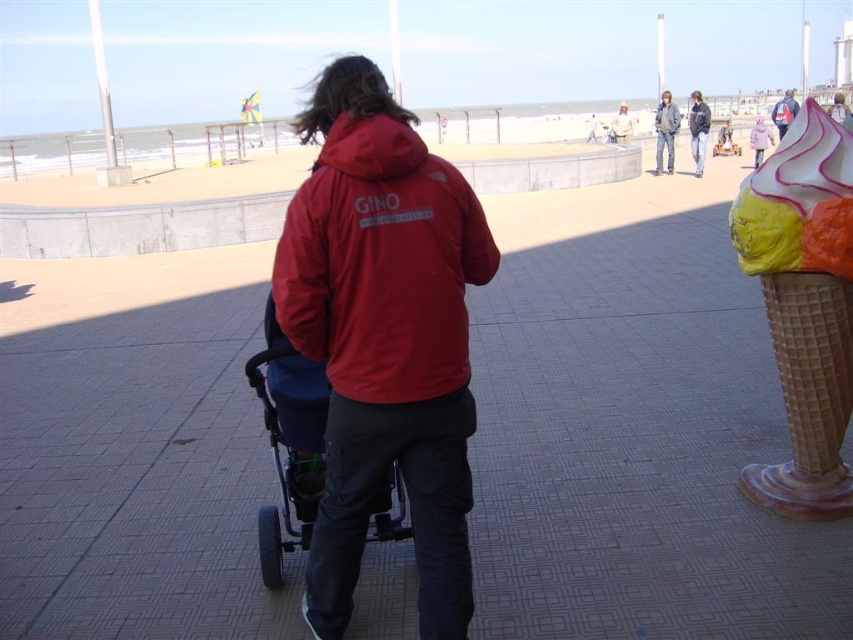
You are a photographer trying to capture a photo of the white waffle cone at right without the red matte jacket at center blocking it. Where should you move to get a clear shot?

The red matte jacket at center is in front of the white waffle cone at right, so you should move to the left side of the scene to position yourself where the red matte jacket at center is no longer blocking the view of the white waffle cone at right.

You are a tourist visiting the seaside promenade. You see the red matte jacket at center and the white waffle cone at right. Which object is larger in size?

The white waffle cone at right is larger in size compared to the red matte jacket at center.